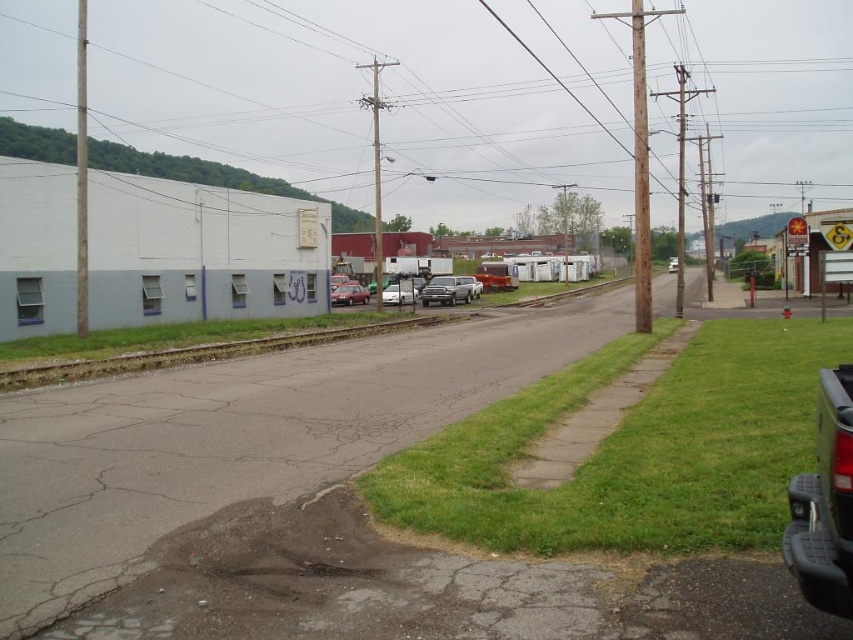
You are standing at the point with coordinates point (401, 291) and want to walk towards the point with coordinates point (792, 339). Which direction should you face to walk straight towards your destination?

You should face towards the direction of point (792, 339) because it is in front of point (401, 291).